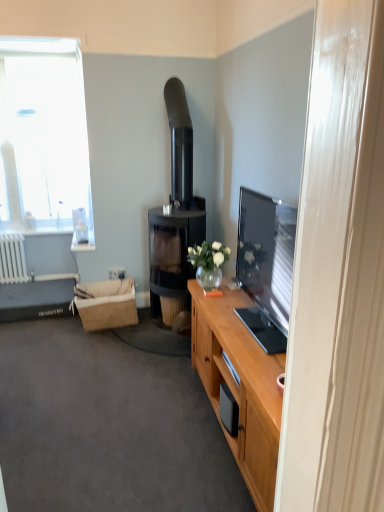
What are the coordinates of `free location to the left of burlap picnic basket at lower left` in the screenshot? It's located at (56, 326).